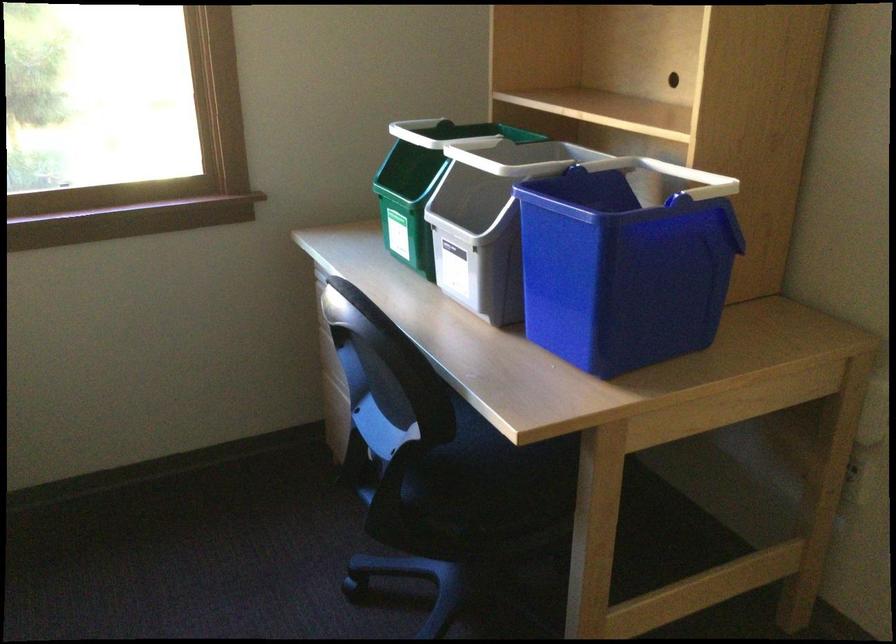
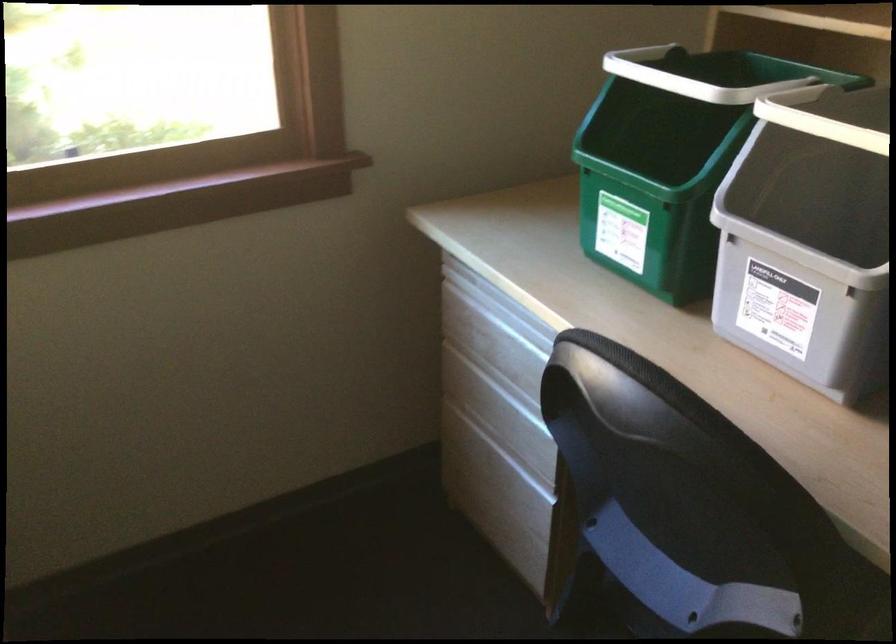
Locate, in the second image, the point that corresponds to the point at 402,207 in the first image.

(652, 194)